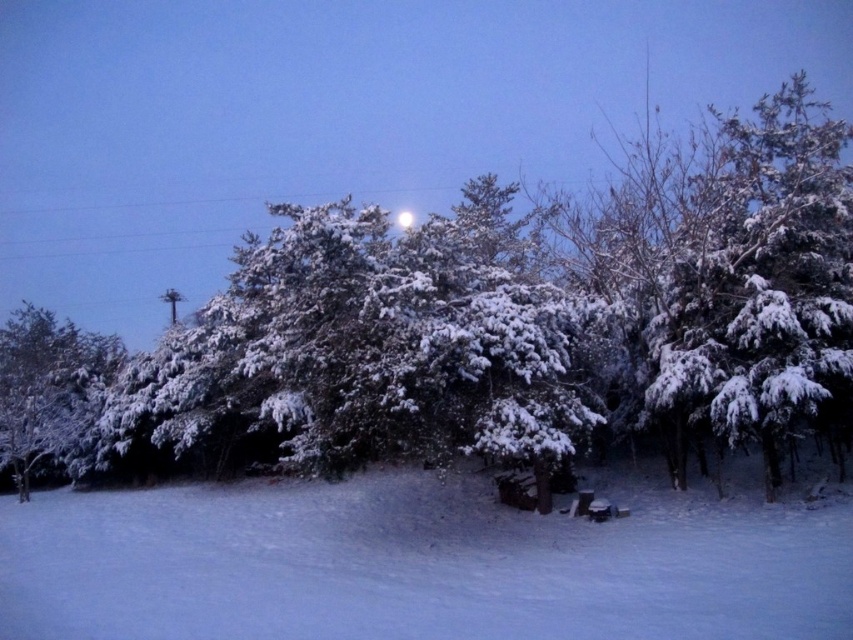
What is located at the coordinates point (486, 324)?

The point (486, 324) marks the location of the snow covered evergreen at center.